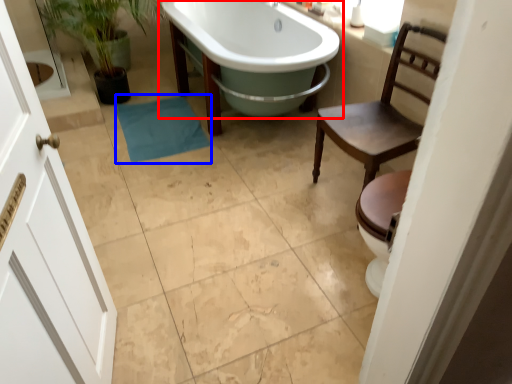
Question: Which of the following is the farthest to the observer, bathtub (highlighted by a red box) or bath towel (highlighted by a blue box)?

Choices:
 (A) bathtub
 (B) bath towel

Answer: (B)